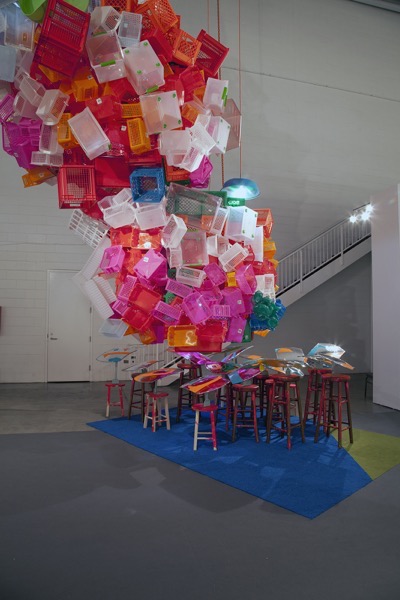
At what (x,y) coordinates should I click in order to perform the action: click on red crates/bins. Please return your answer as a coordinate pair (x, y). Looking at the image, I should click on (159, 44), (213, 329), (150, 299), (136, 318).